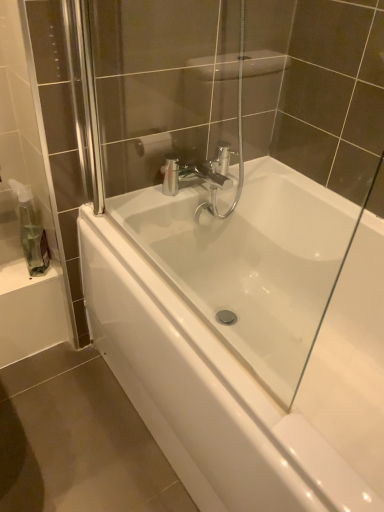
Describe the element at coordinates (247, 338) in the screenshot. I see `white glossy bathtub at center` at that location.

Locate an element on the screen. white glossy bathtub at center is located at coordinates (247, 338).

At what (x,y) coordinates should I click in order to perform the action: click on transparent plastic soap dispenser at left. Please return your answer as a coordinate pair (x, y). Looking at the image, I should click on (30, 230).

The image size is (384, 512). What do you see at coordinates (30, 230) in the screenshot? I see `transparent plastic soap dispenser at left` at bounding box center [30, 230].

What are the coordinates of `white glossy bathtub at center` in the screenshot? It's located at (247, 338).

Considering the relative positions of white glossy bathtub at center and transparent plastic soap dispenser at left in the image provided, is white glossy bathtub at center to the left of transparent plastic soap dispenser at left from the viewer's perspective?

Incorrect, white glossy bathtub at center is not on the left side of transparent plastic soap dispenser at left.

Is white glossy bathtub at center positioned behind transparent plastic soap dispenser at left?

No, white glossy bathtub at center is in front of transparent plastic soap dispenser at left.

Which is closer, (227,292) or (19,218)?

The point (19,218) is closer to the camera.

From the image's perspective, which is above, white glossy bathtub at center or transparent plastic soap dispenser at left?

transparent plastic soap dispenser at left, from the image's perspective.

From a real-world perspective, is white glossy bathtub at center beneath transparent plastic soap dispenser at left?

Indeed, from a real-world perspective, white glossy bathtub at center is positioned beneath transparent plastic soap dispenser at left.

Between white glossy bathtub at center and transparent plastic soap dispenser at left, which one has larger width?

Wider between the two is white glossy bathtub at center.

Consider the image. Which of these two, white glossy bathtub at center or transparent plastic soap dispenser at left, stands taller?

Standing taller between the two is white glossy bathtub at center.

Does white glossy bathtub at center have a smaller size compared to transparent plastic soap dispenser at left?

Incorrect, white glossy bathtub at center is not smaller in size than transparent plastic soap dispenser at left.

Is white glossy bathtub at center not inside transparent plastic soap dispenser at left?

white glossy bathtub at center lies outside transparent plastic soap dispenser at left's area.

Are white glossy bathtub at center and transparent plastic soap dispenser at left beside each other?

No.

Does white glossy bathtub at center turn towards transparent plastic soap dispenser at left?

No, white glossy bathtub at center does not turn towards transparent plastic soap dispenser at left.

I want to click on bathtub below the transparent plastic soap dispenser at left (from a real-world perspective), so pyautogui.click(x=247, y=338).

Between transparent plastic soap dispenser at left and white glossy bathtub at center, which one appears on the right side from the viewer's perspective?

Positioned to the right is white glossy bathtub at center.

Is transparent plastic soap dispenser at left further to the viewer compared to white glossy bathtub at center?

Yes, transparent plastic soap dispenser at left is further from the viewer.

Is point (27, 200) farther from viewer compared to point (333, 304)?

That is False.

From the image's perspective, between transparent plastic soap dispenser at left and white glossy bathtub at center, which one is located above?

From the image's view, transparent plastic soap dispenser at left is above.

From a real-world perspective, is transparent plastic soap dispenser at left positioned under white glossy bathtub at center based on gravity?

No, from a real-world perspective, transparent plastic soap dispenser at left is not beneath white glossy bathtub at center.

Which object is wider, transparent plastic soap dispenser at left or white glossy bathtub at center?

white glossy bathtub at center is wider.

Considering the sizes of objects transparent plastic soap dispenser at left and white glossy bathtub at center in the image provided, who is shorter, transparent plastic soap dispenser at left or white glossy bathtub at center?

transparent plastic soap dispenser at left is shorter.

Who is bigger, transparent plastic soap dispenser at left or white glossy bathtub at center?

white glossy bathtub at center.

Does transparent plastic soap dispenser at left contain white glossy bathtub at center?

That's incorrect, white glossy bathtub at center is not inside transparent plastic soap dispenser at left.

Is transparent plastic soap dispenser at left not near white glossy bathtub at center?

No.

Is transparent plastic soap dispenser at left facing towards white glossy bathtub at center?

No.

How distant is transparent plastic soap dispenser at left from white glossy bathtub at center?

They are 23.69 inches apart.

What are the coordinates of `soap dispenser that is on the left side of white glossy bathtub at center` in the screenshot? It's located at (x=30, y=230).

I want to click on soap dispenser above the white glossy bathtub at center (from the image's perspective), so click(x=30, y=230).

Where is `soap dispenser lying behind the white glossy bathtub at center`? The height and width of the screenshot is (512, 384). soap dispenser lying behind the white glossy bathtub at center is located at coordinates (30, 230).